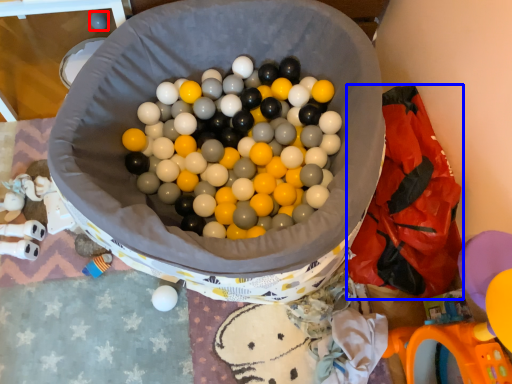
Question: Which of the following is the closest to the observer, toy (highlighted by a red box) or material (highlighted by a blue box)?

Choices:
 (A) toy
 (B) material

Answer: (B)